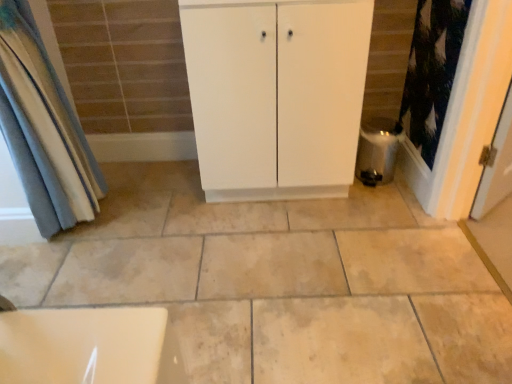
I want to click on free point below blue fabric curtain at left (from a real-world perspective), so [x=81, y=232].